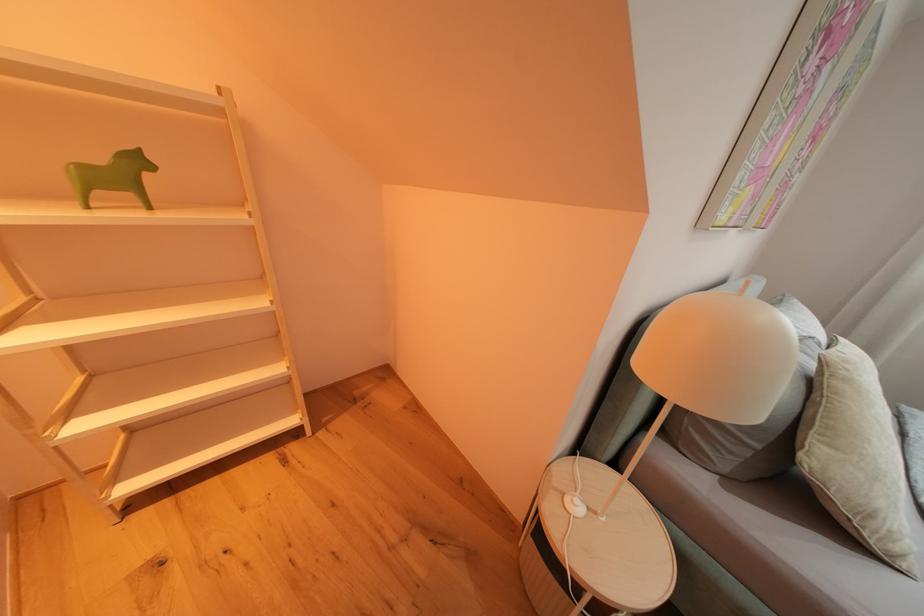
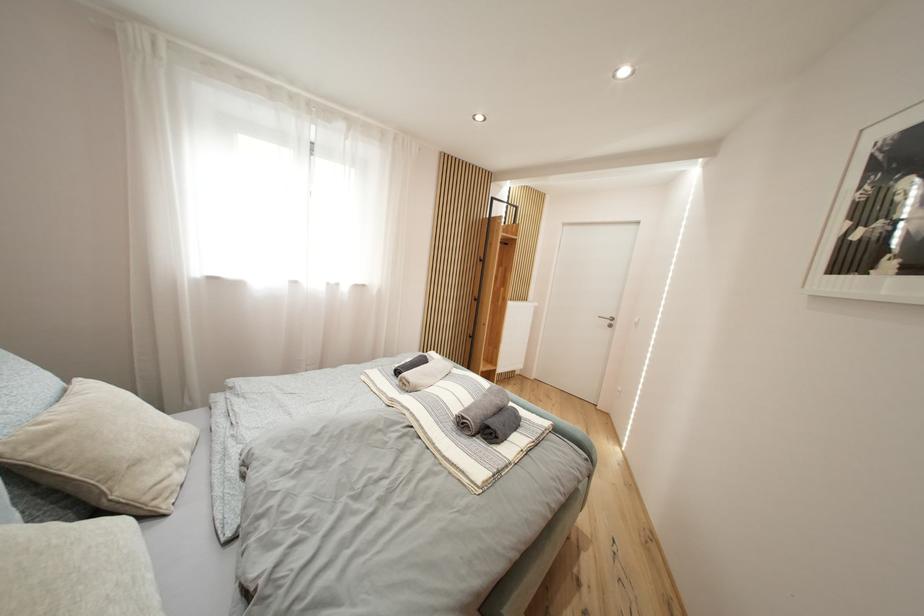
The images are taken continuously from a first-person perspective. In which direction is your viewpoint rotating?

The rotation direction of the camera is right-down.